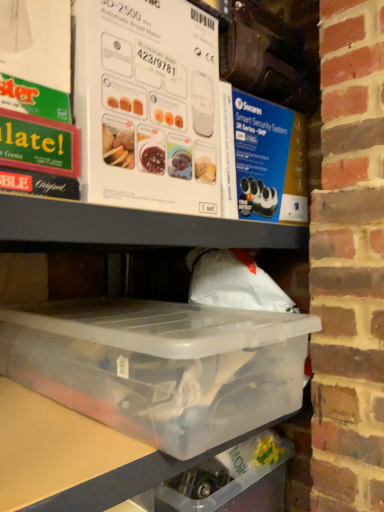
What is the approximate height of white cardboard box at upper center, arranged as the 2th box when ordered from the bottom?

It is 63.37 centimeters.

This screenshot has height=512, width=384. Describe the element at coordinates (147, 105) in the screenshot. I see `white cardboard box at upper center, positioned as the 1th box in top-to-bottom order` at that location.

Locate an element on the screen. white cardboard box at upper center, arranged as the 2th box when ordered from the bottom is located at coordinates (147, 105).

What do you see at coordinates (160, 366) in the screenshot?
I see `transparent plastic container at lower center, which is counted as the 2th box, starting from the top` at bounding box center [160, 366].

At what (x,y) coordinates should I click in order to perform the action: click on transparent plastic container at lower center, which ranks as the 1th box in bottom-to-top order. Please return your answer as a coordinate pair (x, y). The image size is (384, 512). Looking at the image, I should click on (160, 366).

Locate an element on the screen. The image size is (384, 512). white cardboard box at upper center, arranged as the 2th box when ordered from the bottom is located at coordinates (147, 105).

Is white cardboard box at upper center, positioned as the 1th box in top-to-bottom order, to the left of transparent plastic container at lower center, which is counted as the 2th box, starting from the top, from the viewer's perspective?

Correct, you'll find white cardboard box at upper center, positioned as the 1th box in top-to-bottom order, to the left of transparent plastic container at lower center, which is counted as the 2th box, starting from the top.

Considering their positions, is white cardboard box at upper center, positioned as the 1th box in top-to-bottom order, located in front of or behind transparent plastic container at lower center, which ranks as the 1th box in bottom-to-top order?

Clearly, white cardboard box at upper center, positioned as the 1th box in top-to-bottom order, is behind transparent plastic container at lower center, which ranks as the 1th box in bottom-to-top order.

Does point (173, 112) come behind point (53, 342)?

No, (173, 112) is closer to viewer.

From the image's perspective, who appears lower, white cardboard box at upper center, arranged as the 2th box when ordered from the bottom, or transparent plastic container at lower center, which ranks as the 1th box in bottom-to-top order?

From the image's view, transparent plastic container at lower center, which ranks as the 1th box in bottom-to-top order, is below.

Based on the photo, from a real-world perspective, which object rests below the other?

transparent plastic container at lower center, which is counted as the 2th box, starting from the top.

Considering the sizes of white cardboard box at upper center, positioned as the 1th box in top-to-bottom order, and transparent plastic container at lower center, which is counted as the 2th box, starting from the top, in the image, is white cardboard box at upper center, positioned as the 1th box in top-to-bottom order, wider or thinner than transparent plastic container at lower center, which is counted as the 2th box, starting from the top,?

white cardboard box at upper center, positioned as the 1th box in top-to-bottom order, is thinner than transparent plastic container at lower center, which is counted as the 2th box, starting from the top.

Considering the relative sizes of white cardboard box at upper center, arranged as the 2th box when ordered from the bottom, and transparent plastic container at lower center, which is counted as the 2th box, starting from the top, in the image provided, is white cardboard box at upper center, arranged as the 2th box when ordered from the bottom, shorter than transparent plastic container at lower center, which is counted as the 2th box, starting from the top,?

In fact, white cardboard box at upper center, arranged as the 2th box when ordered from the bottom, may be taller than transparent plastic container at lower center, which is counted as the 2th box, starting from the top.

Does white cardboard box at upper center, positioned as the 1th box in top-to-bottom order, have a smaller size compared to transparent plastic container at lower center, which is counted as the 2th box, starting from the top?

Incorrect, white cardboard box at upper center, positioned as the 1th box in top-to-bottom order, is not smaller in size than transparent plastic container at lower center, which is counted as the 2th box, starting from the top.

Is white cardboard box at upper center, positioned as the 1th box in top-to-bottom order, inside or outside of transparent plastic container at lower center, which is counted as the 2th box, starting from the top?

The correct answer is: outside.

Looking at this image, is white cardboard box at upper center, positioned as the 1th box in top-to-bottom order, far away from transparent plastic container at lower center, which ranks as the 1th box in bottom-to-top order?

No, white cardboard box at upper center, positioned as the 1th box in top-to-bottom order, is not far from transparent plastic container at lower center, which ranks as the 1th box in bottom-to-top order.

Is white cardboard box at upper center, positioned as the 1th box in top-to-bottom order, oriented away from transparent plastic container at lower center, which is counted as the 2th box, starting from the top?

No, white cardboard box at upper center, positioned as the 1th box in top-to-bottom order,'s orientation is not away from transparent plastic container at lower center, which is counted as the 2th box, starting from the top.

Can you tell me how much white cardboard box at upper center, positioned as the 1th box in top-to-bottom order, and transparent plastic container at lower center, which ranks as the 1th box in bottom-to-top order, differ in facing direction?

5.94 degrees separate the facing orientations of white cardboard box at upper center, positioned as the 1th box in top-to-bottom order, and transparent plastic container at lower center, which ranks as the 1th box in bottom-to-top order.

How far apart are white cardboard box at upper center, arranged as the 2th box when ordered from the bottom, and transparent plastic container at lower center, which is counted as the 2th box, starting from the top?

white cardboard box at upper center, arranged as the 2th box when ordered from the bottom, is 13.86 inches from transparent plastic container at lower center, which is counted as the 2th box, starting from the top.

The height and width of the screenshot is (512, 384). Identify the location of box in front of the white cardboard box at upper center, arranged as the 2th box when ordered from the bottom. (160, 366).

Considering the relative positions of transparent plastic container at lower center, which is counted as the 2th box, starting from the top, and white cardboard box at upper center, positioned as the 1th box in top-to-bottom order, in the image provided, is transparent plastic container at lower center, which is counted as the 2th box, starting from the top, to the left of white cardboard box at upper center, positioned as the 1th box in top-to-bottom order, from the viewer's perspective?

In fact, transparent plastic container at lower center, which is counted as the 2th box, starting from the top, is to the right of white cardboard box at upper center, positioned as the 1th box in top-to-bottom order.

Looking at this image, is transparent plastic container at lower center, which ranks as the 1th box in bottom-to-top order, behind white cardboard box at upper center, arranged as the 2th box when ordered from the bottom?

That is False.

Which is behind, point (41, 345) or point (101, 18)?

The point (41, 345) is farther.

From the image's perspective, is transparent plastic container at lower center, which is counted as the 2th box, starting from the top, on white cardboard box at upper center, positioned as the 1th box in top-to-bottom order?

Incorrect, from the image's perspective, transparent plastic container at lower center, which is counted as the 2th box, starting from the top, is lower than white cardboard box at upper center, positioned as the 1th box in top-to-bottom order.

From a real-world perspective, between transparent plastic container at lower center, which is counted as the 2th box, starting from the top, and white cardboard box at upper center, arranged as the 2th box when ordered from the bottom, who is vertically higher?

white cardboard box at upper center, arranged as the 2th box when ordered from the bottom, is physically above.

Which of these two, transparent plastic container at lower center, which is counted as the 2th box, starting from the top, or white cardboard box at upper center, arranged as the 2th box when ordered from the bottom, is thinner?

white cardboard box at upper center, arranged as the 2th box when ordered from the bottom.

In terms of height, does transparent plastic container at lower center, which ranks as the 1th box in bottom-to-top order, look taller or shorter compared to white cardboard box at upper center, positioned as the 1th box in top-to-bottom order?

In the image, transparent plastic container at lower center, which ranks as the 1th box in bottom-to-top order, appears to be shorter than white cardboard box at upper center, positioned as the 1th box in top-to-bottom order.

Is transparent plastic container at lower center, which is counted as the 2th box, starting from the top, bigger or smaller than white cardboard box at upper center, positioned as the 1th box in top-to-bottom order?

In the image, transparent plastic container at lower center, which is counted as the 2th box, starting from the top, appears to be smaller than white cardboard box at upper center, positioned as the 1th box in top-to-bottom order.

Could white cardboard box at upper center, positioned as the 1th box in top-to-bottom order, be considered to be inside transparent plastic container at lower center, which ranks as the 1th box in bottom-to-top order?

No, white cardboard box at upper center, positioned as the 1th box in top-to-bottom order, is not inside transparent plastic container at lower center, which ranks as the 1th box in bottom-to-top order.

Is the surface of transparent plastic container at lower center, which ranks as the 1th box in bottom-to-top order, in direct contact with white cardboard box at upper center, arranged as the 2th box when ordered from the bottom?

There is a gap between transparent plastic container at lower center, which ranks as the 1th box in bottom-to-top order, and white cardboard box at upper center, arranged as the 2th box when ordered from the bottom.

Does transparent plastic container at lower center, which ranks as the 1th box in bottom-to-top order, turn towards white cardboard box at upper center, positioned as the 1th box in top-to-bottom order?

No, transparent plastic container at lower center, which ranks as the 1th box in bottom-to-top order, is not aimed at white cardboard box at upper center, positioned as the 1th box in top-to-bottom order.

This screenshot has height=512, width=384. Identify the location of box below the white cardboard box at upper center, arranged as the 2th box when ordered from the bottom (from the image's perspective). (160, 366).

At what (x,y) coordinates should I click in order to perform the action: click on box that appears on the left of transparent plastic container at lower center, which ranks as the 1th box in bottom-to-top order. Please return your answer as a coordinate pair (x, y). Looking at the image, I should click on (147, 105).

In the image, there is a white cardboard box at upper center, positioned as the 1th box in top-to-bottom order. Where is `box below it (from the image's perspective)`? This screenshot has height=512, width=384. box below it (from the image's perspective) is located at coordinates (160, 366).